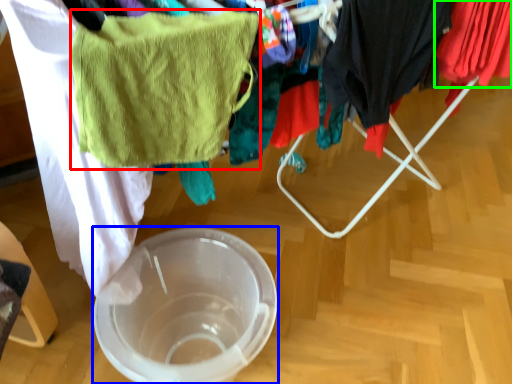
Question: Which is farther away from towel/napkin (highlighted by a red box)? glass bowl (highlighted by a blue box) or clothing (highlighted by a green box)?

Choices:
 (A) glass bowl
 (B) clothing

Answer: (B)